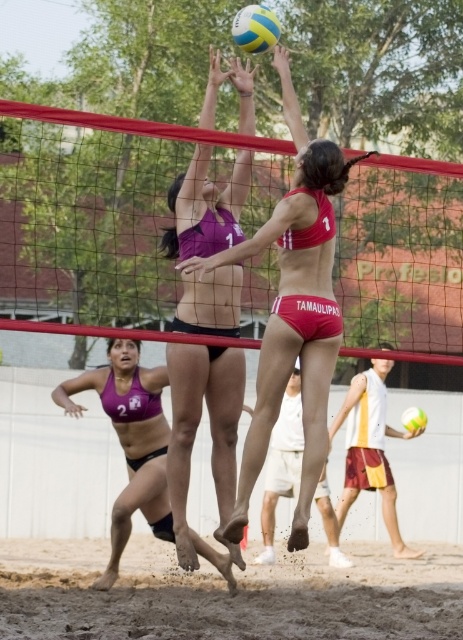
Question: Among these objects, which one is nearest to the camera?

Choices:
 (A) matte pink bikini at center
 (B) matte purple bikini at center

Answer: (A)

Question: Which point is closer to the camera?

Choices:
 (A) purple matte bikini at lower left
 (B) yellow and blue striped volleyball at center
 (C) yellow-green textured volleyball at upper center
 (D) red mesh net at center

Answer: (D)

Question: Does matte purple bikini at center have a greater width compared to yellow-green textured volleyball at upper center?

Choices:
 (A) no
 (B) yes

Answer: (B)

Question: Considering the relative positions of matte purple bikini at center and yellow and blue striped volleyball at center in the image provided, where is matte purple bikini at center located with respect to yellow and blue striped volleyball at center?

Choices:
 (A) above
 (B) below

Answer: (A)

Question: Is red mesh net at center further to the viewer compared to brown sandy beach at lower center?

Choices:
 (A) no
 (B) yes

Answer: (A)

Question: Which of the following is the closest to the observer?

Choices:
 (A) (404, 419)
 (B) (192, 256)
 (C) (248, 44)
 (D) (135, 566)

Answer: (C)